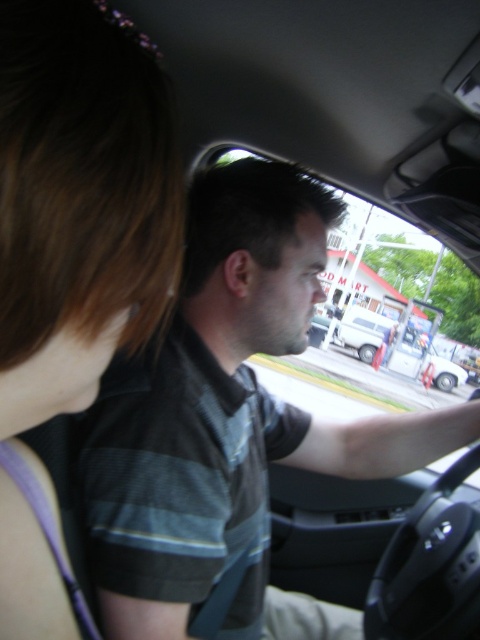
Does dark green striped shirt at center come behind brown hair at upper left?

Yes.

Measure the distance between dark green striped shirt at center and camera.

A distance of 25.61 inches exists between dark green striped shirt at center and camera.

You are a GUI agent. You are given a task and a screenshot of the screen. Output one action in this format:
    pyautogui.click(x=<x>, y=<y>)
    Task: Click on the dark green striped shirt at center
    
    Given the screenshot: What is the action you would take?
    pyautogui.click(x=226, y=417)

Between point (41, 189) and point (422, 348), which one is positioned behind?

The point (422, 348) is more distant.

Does brown hair at upper left have a larger size compared to white matte van at center?

Incorrect, brown hair at upper left is not larger than white matte van at center.

Which is in front, point (36, 598) or point (362, 355)?

Point (36, 598) is more forward.

Image resolution: width=480 pixels, height=640 pixels. I want to click on brown hair at upper left, so click(x=79, y=204).

Between dark green striped shirt at center and white matte van at center, which one appears on the right side from the viewer's perspective?

Positioned to the right is white matte van at center.

Which is above, dark green striped shirt at center or white matte van at center?

dark green striped shirt at center is higher up.

You are a GUI agent. You are given a task and a screenshot of the screen. Output one action in this format:
    pyautogui.click(x=<x>, y=<y>)
    Task: Click on the dark green striped shirt at center
    The image size is (480, 640).
    Given the screenshot: What is the action you would take?
    pyautogui.click(x=226, y=417)